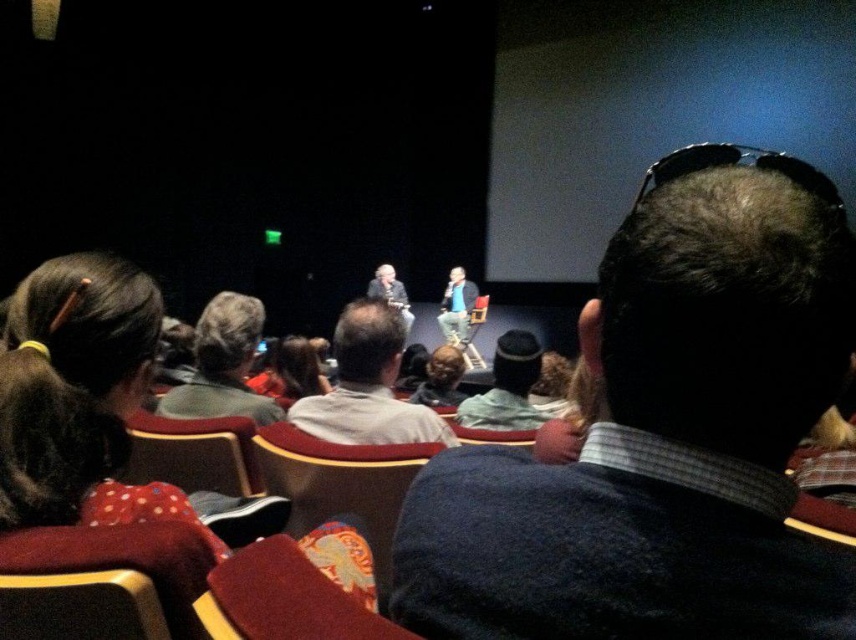
You are sitting in the theater and want to determine which of the two points, point (18, 374) or point (547, 413), is closer to you. Based on the scene description, which point is nearer?

Point (18, 374) is closer to the viewer than point (547, 413).